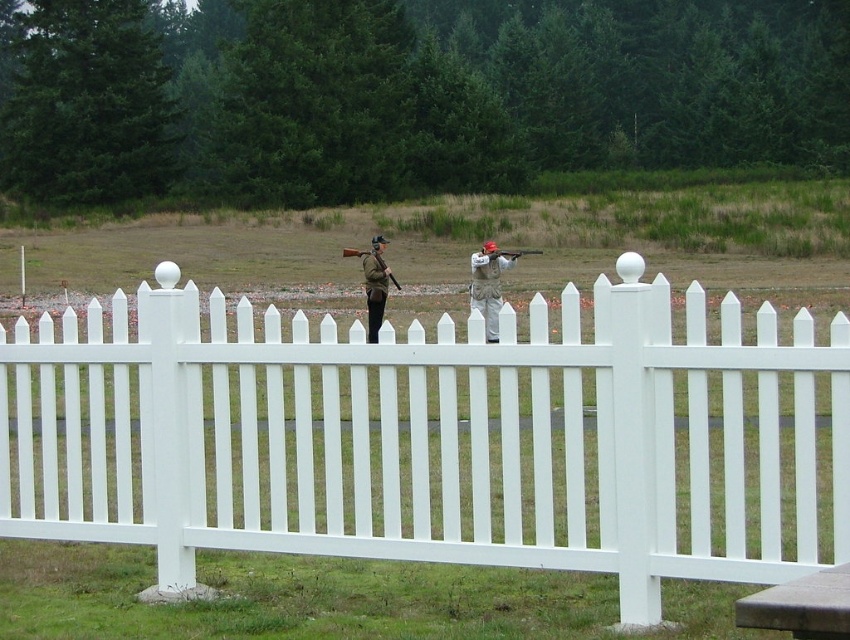
Question: Is camouflage fabric uniform at center below wooden shotgun at center?

Choices:
 (A) yes
 (B) no

Answer: (A)

Question: Is white picket fence at center below khaki fabric uniform at center?

Choices:
 (A) no
 (B) yes

Answer: (B)

Question: Is brown wooden picnic table at lower right thinner than matte brown shotgun at center?

Choices:
 (A) yes
 (B) no

Answer: (A)

Question: Which point is farther to the camera?

Choices:
 (A) khaki fabric uniform at center
 (B) camouflage fabric uniform at center
 (C) brown wooden picnic table at lower right

Answer: (B)

Question: Among these points, which one is farthest from the camera?

Choices:
 (A) (348, 256)
 (B) (471, 262)

Answer: (A)

Question: Which of the following is the farthest from the observer?

Choices:
 (A) (777, 589)
 (B) (366, 276)
 (C) (491, 243)
 (D) (99, 330)

Answer: (C)